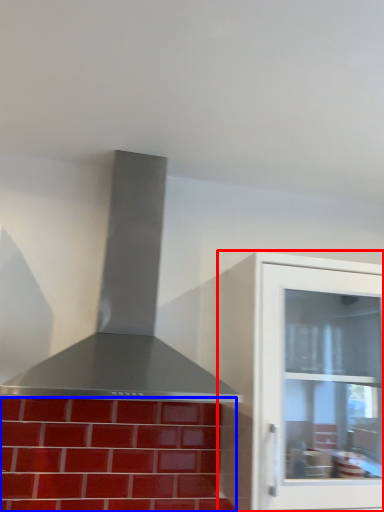
Question: Which point is further to the camera, cabinetry (highlighted by a red box) or brickwork (highlighted by a blue box)?

Choices:
 (A) cabinetry
 (B) brickwork

Answer: (B)